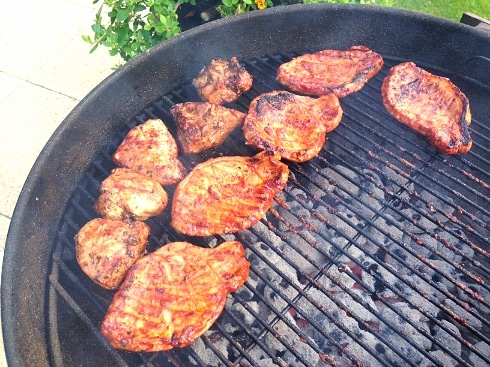
Identify the location of floor. This screenshot has width=490, height=367. (44, 105).